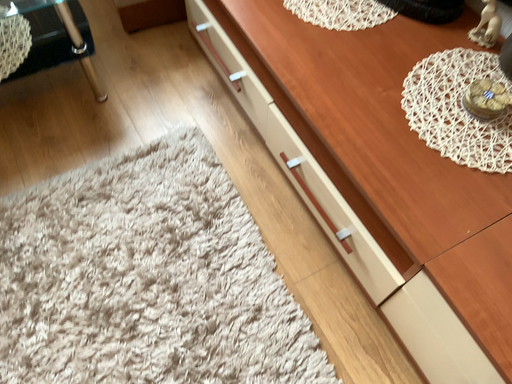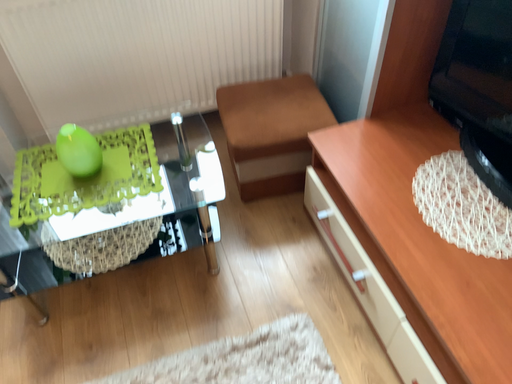
Question: Which way did the camera rotate in the video?

Choices:
 (A) rotated upward
 (B) rotated downward

Answer: (A)